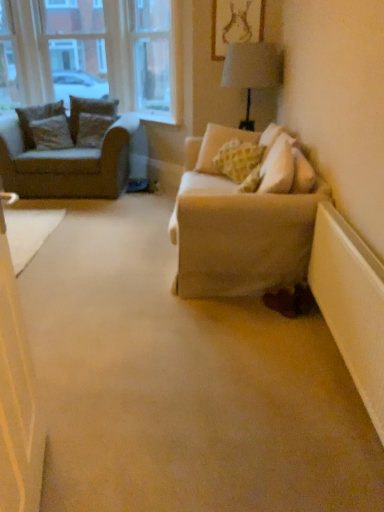
Find the location of a particular element. This screenshot has width=384, height=512. matte gold picture frame at upper center is located at coordinates (235, 24).

This screenshot has width=384, height=512. Describe the element at coordinates (235, 24) in the screenshot. I see `matte gold picture frame at upper center` at that location.

The width and height of the screenshot is (384, 512). Describe the element at coordinates (156, 58) in the screenshot. I see `clear glass window frame at upper left` at that location.

Describe the element at coordinates (67, 151) in the screenshot. This screenshot has width=384, height=512. I see `beige fabric armchair at left` at that location.

What is the approximate height of white plastic radiator at lower right?

It is 25.40 inches.

Locate an element on the screen. This screenshot has height=512, width=384. brown textured pillow at left, the first pillow when ordered from left to right is located at coordinates (37, 117).

This screenshot has height=512, width=384. Find the location of `matte gold picture frame at upper center`. matte gold picture frame at upper center is located at coordinates (235, 24).

Visually, is white plastic radiator at lower right positioned to the left or to the right of clear glass window frame at upper left?

In the image, white plastic radiator at lower right appears on the right side of clear glass window frame at upper left.

From the image's perspective, which object appears higher, white plastic radiator at lower right or clear glass window frame at upper left?

clear glass window frame at upper left.

How much distance is there between white plastic radiator at lower right and clear glass window frame at upper left?

white plastic radiator at lower right and clear glass window frame at upper left are 11.20 feet apart.

Which is behind, point (362, 291) or point (133, 91)?

The point (133, 91) is more distant.

From a real-world perspective, is clear glass window frame at upper left on velvet brown pillow at left, positioned as the third pillow in left-to-right order?

Yes, from a real-world perspective, clear glass window frame at upper left is above velvet brown pillow at left, positioned as the third pillow in left-to-right order.

Measure the distance between clear glass window frame at upper left and velvet brown pillow at left, positioned as the third pillow in left-to-right order.

clear glass window frame at upper left is 27.36 inches away from velvet brown pillow at left, positioned as the third pillow in left-to-right order.

How different are the orientations of clear glass window frame at upper left and velvet brown pillow at left, which ranks as the second pillow in right-to-left order, in degrees?

clear glass window frame at upper left and velvet brown pillow at left, which ranks as the second pillow in right-to-left order, are facing 38.9 degrees away from each other.

Is clear glass window frame at upper left further to the viewer compared to velvet brown pillow at left, positioned as the third pillow in left-to-right order?

No.

In order to click on the 1st pillow positioned above the beige fabric armchair at left (from the image's perspective) in this screenshot , I will do `click(51, 133)`.

Which of these two, brown textured pillow at left, the third pillow from the right, or beige fabric armchair at left, is smaller?

Smaller between the two is brown textured pillow at left, the third pillow from the right.

From the image's perspective, which is below, brown textured pillow at left, arranged as the second pillow when viewed from the left, or beige fabric armchair at left?

beige fabric armchair at left, from the image's perspective.

How different are the orientations of brown textured pillow at left, the third pillow from the right, and beige fabric armchair at left in degrees?

There is a 24-degree angle between the facing directions of brown textured pillow at left, the third pillow from the right, and beige fabric armchair at left.

Which is in front, point (26, 122) or point (58, 194)?

Point (58, 194)

From a real-world perspective, is brown textured pillow at left, acting as the 4th pillow starting from the right, physically located above or below beige fabric armchair at left?

brown textured pillow at left, acting as the 4th pillow starting from the right, is above beige fabric armchair at left.

Is brown textured pillow at left, the first pillow when ordered from left to right, wider or thinner than beige fabric armchair at left?

Considering their sizes, brown textured pillow at left, the first pillow when ordered from left to right, looks slimmer than beige fabric armchair at left.

From the image's perspective, is brown textured pillow at left, acting as the 4th pillow starting from the right, located above or below beige fabric armchair at left?

Based on their image positions, brown textured pillow at left, acting as the 4th pillow starting from the right, is located above beige fabric armchair at left.

Would you consider beige fabric armchair at left to be distant from matte gold picture frame at upper center?

That's right, there is a large distance between beige fabric armchair at left and matte gold picture frame at upper center.

Based on the photo, from the image's perspective, is beige fabric armchair at left located above matte gold picture frame at upper center?

No, from the image's perspective, beige fabric armchair at left is not on top of matte gold picture frame at upper center.

Is beige fabric armchair at left facing away from matte gold picture frame at upper center?

No, beige fabric armchair at left is not facing the opposite direction of matte gold picture frame at upper center.

How distant is beige fabric armchair at left from matte gold picture frame at upper center?

beige fabric armchair at left and matte gold picture frame at upper center are 5.66 feet apart from each other.

Is point (344, 333) closer to viewer compared to point (222, 6)?

Yes, it is in front of point (222, 6).

Which of these two, white plastic radiator at lower right or matte gold picture frame at upper center, is smaller?

matte gold picture frame at upper center is smaller.

Is white plastic radiator at lower right turned away from matte gold picture frame at upper center?

No, white plastic radiator at lower right is not facing away from matte gold picture frame at upper center.

Can you confirm if beige fabric armchair at left is positioned to the right of clear glass window frame at upper left?

Incorrect, beige fabric armchair at left is not on the right side of clear glass window frame at upper left.

From the image's perspective, which one is positioned lower, beige fabric armchair at left or clear glass window frame at upper left?

beige fabric armchair at left.

Is beige fabric armchair at left situated inside clear glass window frame at upper left or outside?

beige fabric armchair at left cannot be found inside clear glass window frame at upper left.

The height and width of the screenshot is (512, 384). I want to click on radiator in front of the clear glass window frame at upper left, so pyautogui.click(x=351, y=304).

Which pillow is the 3rd one when counting from the back of the clear glass window frame at upper left? Please provide its 2D coordinates.

[(89, 110)]

Based on the photo, considering their positions, is velvet brown pillow at left, positioned as the third pillow in left-to-right order, positioned further to brown textured pillow at left, the third pillow from the right, than white plastic radiator at lower right?

white plastic radiator at lower right is positioned further to the anchor brown textured pillow at left, the third pillow from the right.

Estimate the real-world distances between objects in this image. Which object is closer to white plastic radiator at lower right, beige fabric armchair at left or velvet brown pillow at left, positioned as the third pillow in left-to-right order?

beige fabric armchair at left.

Based on their spatial positions, is clear glass window frame at upper left or light beige fabric pillow at center, the first pillow from the right, closer to velvet brown pillow at left, which ranks as the second pillow in right-to-left order?

clear glass window frame at upper left is closer to velvet brown pillow at left, which ranks as the second pillow in right-to-left order.

Considering their positions, is light beige fabric pillow at center, the fourth pillow when ordered from left to right, positioned closer to brown textured pillow at left, the first pillow when ordered from left to right, than beige fabric armchair at left?

beige fabric armchair at left lies closer to brown textured pillow at left, the first pillow when ordered from left to right, than the other object.

Looking at this image, considering their positions, is clear glass window frame at upper left positioned closer to brown textured pillow at left, the third pillow from the right, than beige fabric armchair at left?

Based on the image, beige fabric armchair at left appears to be nearer to brown textured pillow at left, the third pillow from the right.

Which object lies nearer to the anchor point light beige fabric pillow at center, the fourth pillow when ordered from left to right, beige fabric armchair at left or brown textured pillow at left, acting as the 4th pillow starting from the right?

beige fabric armchair at left lies closer to light beige fabric pillow at center, the fourth pillow when ordered from left to right, than the other object.

Looking at the image, which one is located further to light beige fabric pillow at center, the fourth pillow when ordered from left to right, white plastic radiator at lower right or clear glass window frame at upper left?

white plastic radiator at lower right.

From the picture: Which object lies nearer to the anchor point white plastic radiator at lower right, matte gold picture frame at upper center or light beige fabric pillow at center, the fourth pillow when ordered from left to right?

light beige fabric pillow at center, the fourth pillow when ordered from left to right, is positioned closer to the anchor white plastic radiator at lower right.

Image resolution: width=384 pixels, height=512 pixels. Find the location of `window frame between white plastic radiator at lower right and brown textured pillow at left, the third pillow from the right, along the z-axis`. window frame between white plastic radiator at lower right and brown textured pillow at left, the third pillow from the right, along the z-axis is located at coordinates (156, 58).

Locate an element on the screen. This screenshot has height=512, width=384. window frame located between beige fabric armchair at left and matte gold picture frame at upper center in the left-right direction is located at coordinates (156, 58).

At what (x,y) coordinates should I click in order to perform the action: click on window frame between brown textured pillow at left, arranged as the second pillow when viewed from the left, and matte gold picture frame at upper center, in the horizontal direction. Please return your answer as a coordinate pair (x, y). Looking at the image, I should click on (156, 58).

Image resolution: width=384 pixels, height=512 pixels. Find the location of `window frame between white plastic radiator at lower right and beige fabric armchair at left in the front-back direction`. window frame between white plastic radiator at lower right and beige fabric armchair at left in the front-back direction is located at coordinates (156, 58).